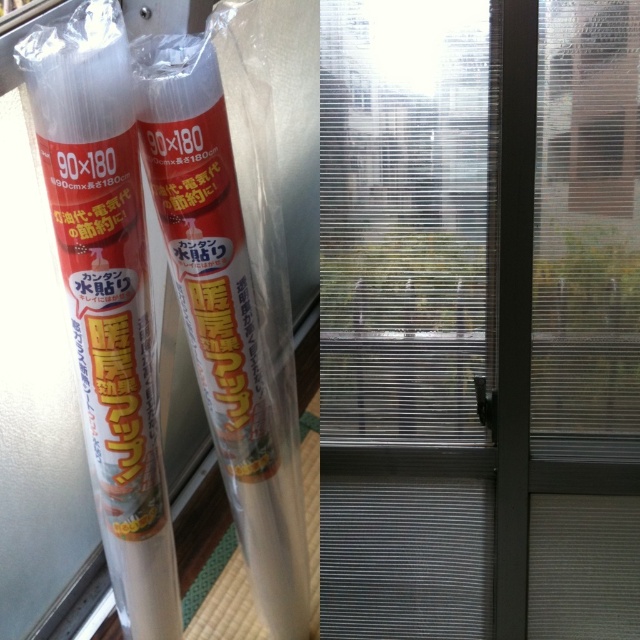
You are standing in a room with a transparent frosted glass door at center and a transparent plastic tube at center. Which object is positioned to the right of the other?

The transparent frosted glass door at center is to the right of the transparent plastic tube at center.

You are a delivery person who needs to move the transparent plastic tube at left through the transparent frosted glass door at center. Can the tube fit through the door?

The transparent frosted glass door at center is wider than the transparent plastic tube at left, so the tube can fit through the door.

You are standing in front of the two cylindrical rolls of product on the left side of the image. You notice two points marked on the rolls. Which point, point (227, 122) or point (97, 387), is closer to you?

Point (97, 387) is closer to you because it is less further to the camera than point (227, 122).